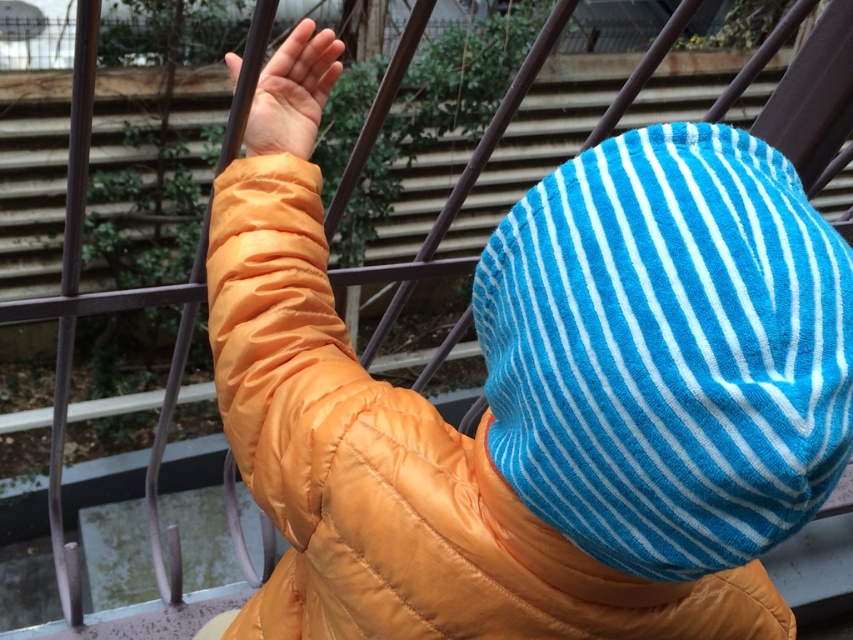
Question: Which object is positioned farthest from the blue striped hat at center?

Choices:
 (A) orange matte hand at upper center
 (B) blue striped towel at upper center

Answer: (A)

Question: Which point is closer to the camera?

Choices:
 (A) blue striped hat at center
 (B) orange matte hand at upper center

Answer: (A)

Question: Can you confirm if blue striped towel at upper center is positioned to the left of orange matte hand at upper center?

Choices:
 (A) no
 (B) yes

Answer: (A)

Question: Is blue striped hat at center thinner than blue striped towel at upper center?

Choices:
 (A) no
 (B) yes

Answer: (A)

Question: Is blue striped hat at center to the right of blue striped towel at upper center from the viewer's perspective?

Choices:
 (A) yes
 (B) no

Answer: (B)

Question: Which of the following is the closest to the observer?

Choices:
 (A) (294, 148)
 (B) (496, 445)

Answer: (B)